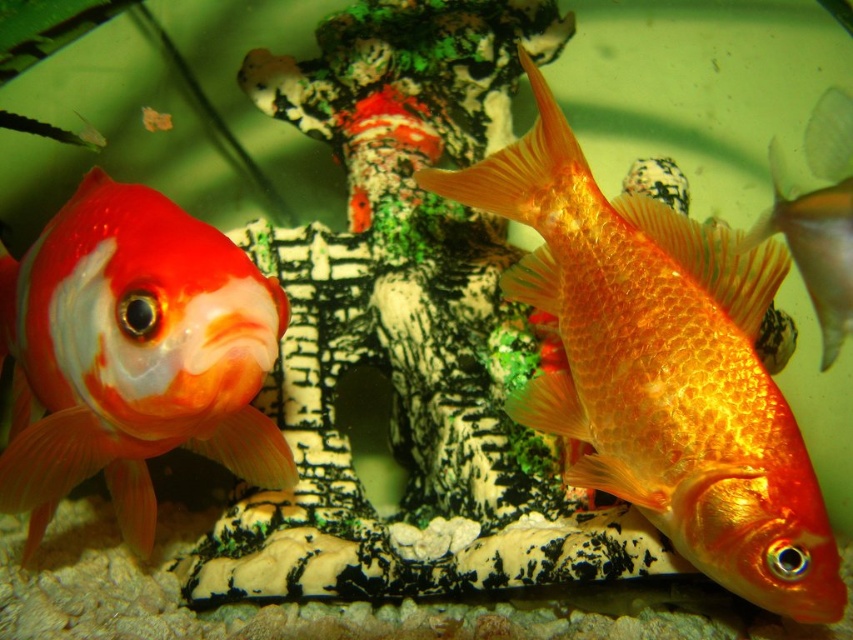
Can you confirm if shiny orange fish at center is positioned below shiny orange goldfish at left?

Actually, shiny orange fish at center is above shiny orange goldfish at left.

Does shiny orange fish at center appear on the left side of shiny orange goldfish at left?

In fact, shiny orange fish at center is to the right of shiny orange goldfish at left.

Is point (570, 148) farther from viewer compared to point (167, 337)?

Yes, point (570, 148) is behind point (167, 337).

The height and width of the screenshot is (640, 853). I want to click on shiny orange fish at center, so click(660, 368).

Between shiny orange fish at center and shiny orange fish at right, which one is positioned higher?

shiny orange fish at right is higher up.

Can you confirm if shiny orange fish at center is shorter than shiny orange fish at right?

Incorrect, shiny orange fish at center's height does not fall short of shiny orange fish at right's.

Who is more forward, (x=772, y=396) or (x=780, y=164)?

Point (x=772, y=396)

Where is `shiny orange fish at center`? The width and height of the screenshot is (853, 640). shiny orange fish at center is located at coordinates (660, 368).

Is shiny orange goldfish at left to the left of shiny orange fish at right from the viewer's perspective?

Yes, shiny orange goldfish at left is to the left of shiny orange fish at right.

Can you confirm if shiny orange goldfish at left is positioned above shiny orange fish at right?

Incorrect, shiny orange goldfish at left is not positioned above shiny orange fish at right.

This screenshot has height=640, width=853. I want to click on shiny orange goldfish at left, so click(x=132, y=355).

Find the location of a particular element. shiny orange goldfish at left is located at coordinates (132, 355).